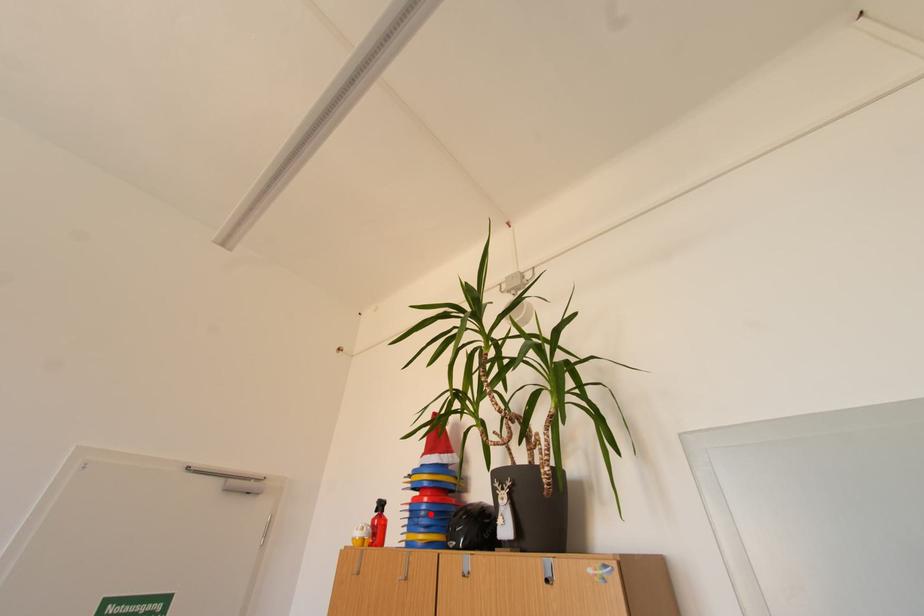
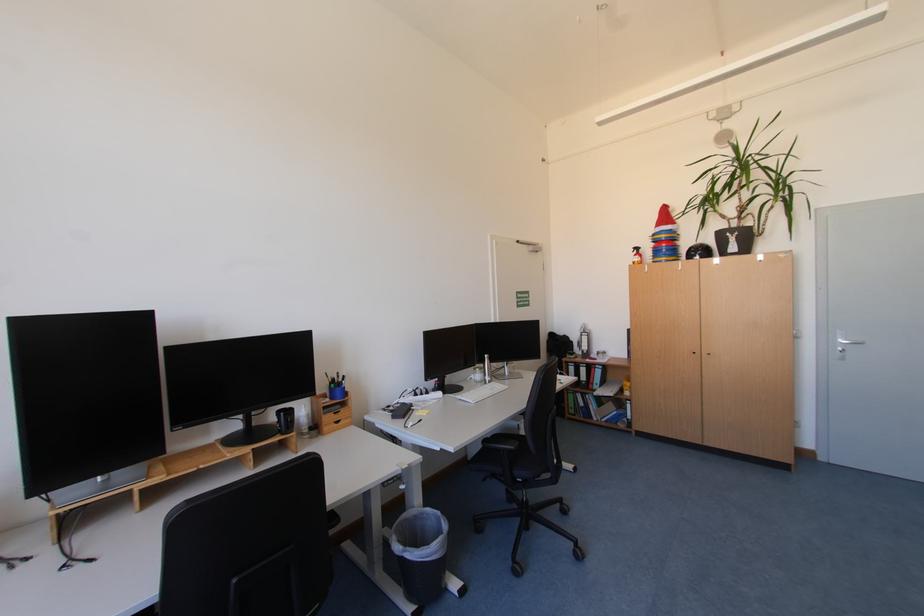
Question: I am providing you with two images of the same scene from different viewpoints. A red point is marked on the first image. Can you still see the location of the red point in image 2?

Choices:
 (A) Yes
 (B) No

Answer: (A)